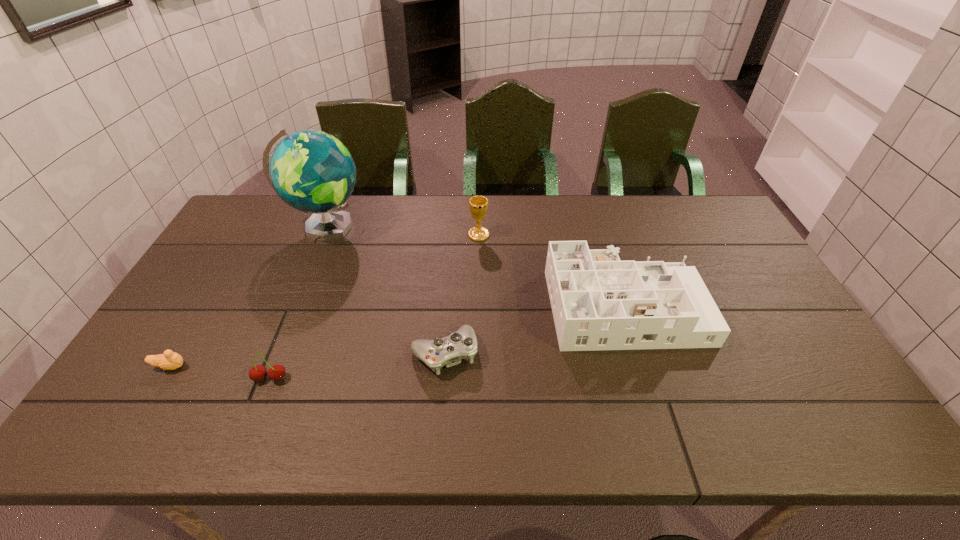
The width and height of the screenshot is (960, 540). I want to click on the tallest object, so click(312, 171).

Locate an element on the screen. chalice is located at coordinates (478, 205).

You are a GUI agent. You are given a task and a screenshot of the screen. Output one action in this format:
    pyautogui.click(x=<x>, y=<y>)
    Task: Click on the rightmost object
    This screenshot has height=540, width=960.
    Given the screenshot: What is the action you would take?
    pyautogui.click(x=599, y=302)

The width and height of the screenshot is (960, 540). I want to click on cherry, so click(276, 372).

You are a GUI agent. You are given a task and a screenshot of the screen. Output one action in this format:
    pyautogui.click(x=<x>, y=<y>)
    Task: Click on the control
    
    Given the screenshot: What is the action you would take?
    pyautogui.click(x=462, y=344)

Locate an element on the screen. duckling is located at coordinates click(x=169, y=360).

Image resolution: width=960 pixels, height=540 pixels. Find the location of `free location located 0.230m on the front surface of the globe`. free location located 0.230m on the front surface of the globe is located at coordinates (434, 227).

You are a GUI agent. You are given a task and a screenshot of the screen. Output one action in this format:
    pyautogui.click(x=<x>, y=<y>)
    Task: Click on the blank area located on the left of the chalice
    The height and width of the screenshot is (540, 960).
    Given the screenshot: What is the action you would take?
    pyautogui.click(x=370, y=235)

This screenshot has height=540, width=960. I want to click on free space located on the left of the rightmost object, so click(x=475, y=307).

This screenshot has width=960, height=540. In order to click on free region located on the surface of the cherry in this screenshot , I will do `click(247, 437)`.